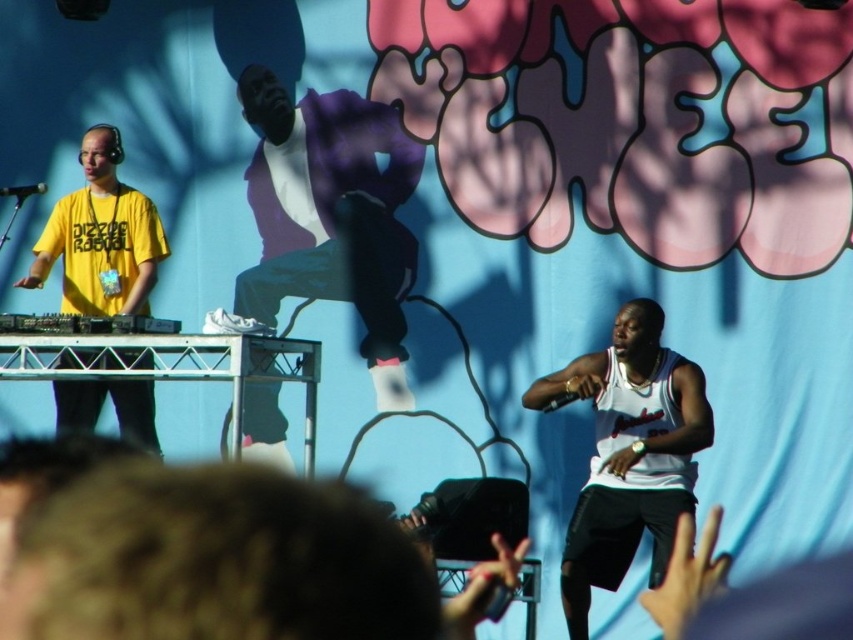
Which is behind, point (656, 301) or point (144, 301)?

Positioned behind is point (656, 301).

Describe the element at coordinates (628, 452) in the screenshot. I see `white jersey at center` at that location.

Which is in front, point (639, 445) or point (73, 275)?

Positioned in front is point (639, 445).

Locate an element on the screen. The image size is (853, 640). white jersey at center is located at coordinates (628, 452).

Is purple cotton jacket at center to the right of yellow matte t-shirt at left from the viewer's perspective?

Answer: Indeed, purple cotton jacket at center is positioned on the right side of yellow matte t-shirt at left.

The image size is (853, 640). I want to click on purple cotton jacket at center, so click(x=329, y=218).

Between white jersey at center and black plastic turntable at left, which one appears on the right side from the viewer's perspective?

Positioned to the right is white jersey at center.

Measure the distance between white jersey at center and black plastic turntable at left.

4.76 feet

Measure the distance between white jersey at center and camera.

The distance of white jersey at center from camera is 29.43 feet.

You are a GUI agent. You are given a task and a screenshot of the screen. Output one action in this format:
    pyautogui.click(x=<x>, y=<y>)
    Task: Click on the white jersey at center
    
    Given the screenshot: What is the action you would take?
    pyautogui.click(x=628, y=452)